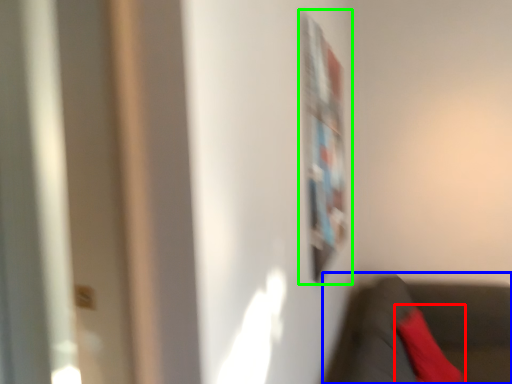
Question: Estimate the real-world distances between objects in this image. Which object is farther from pillow (highlighted by a red box), chair (highlighted by a blue box) or bulletin board (highlighted by a green box)?

Choices:
 (A) chair
 (B) bulletin board

Answer: (B)